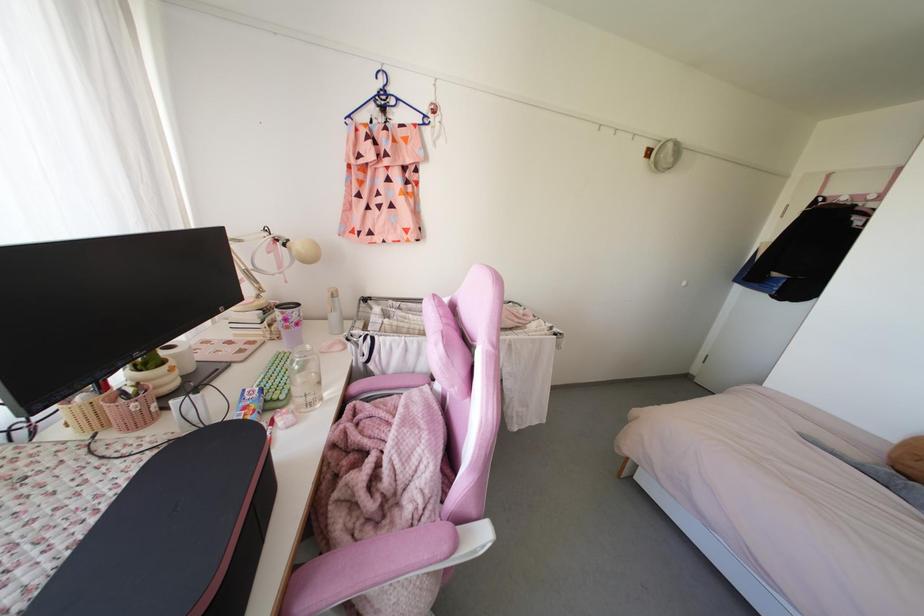
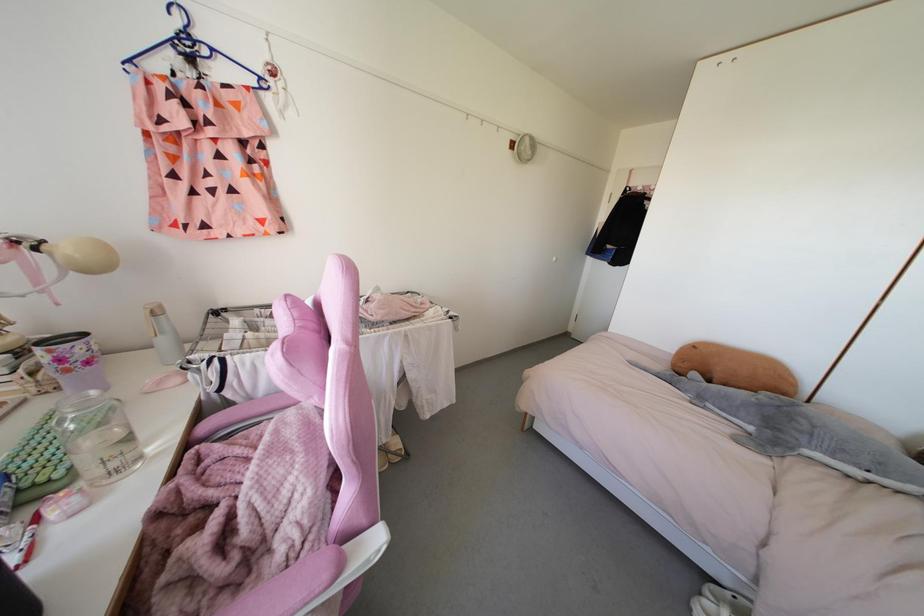
Find the pixel in the second image that matches point 355,387 in the first image.

(204, 426)